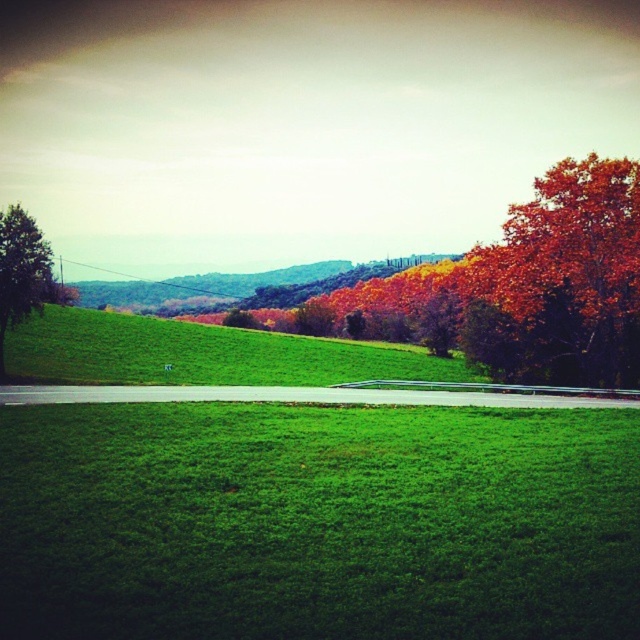
You are a hiker standing on the green grassy field at lower center. You want to reach the green leafy tree at center. Which direction should you move to get closer to the tree?

The green leafy tree at center is taller than the green grassy field at lower center, so you should move forward towards the tree in the direction it is located in the midground.

You are a hiker standing on the paved road in the middle of the image and want to reach the autumn foliage at upper right and the shiny red leaves at right. Which one is closer to you?

The autumn foliage at upper right is closer to you because it is further to the viewer than the shiny red leaves at right.